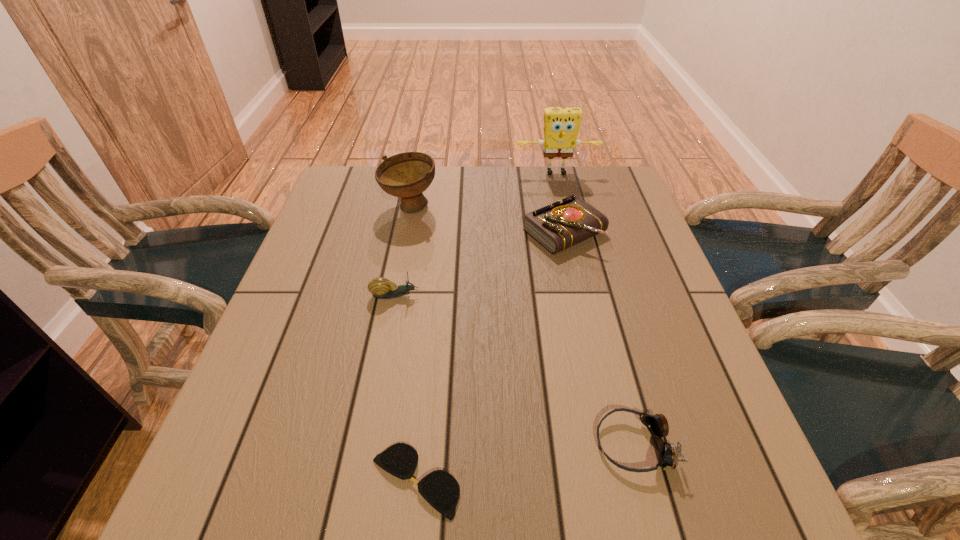
Where is `sponge at the right edge`? The image size is (960, 540). sponge at the right edge is located at coordinates (561, 125).

Where is `diary at the right edge`? The width and height of the screenshot is (960, 540). diary at the right edge is located at coordinates (569, 221).

Identify the location of goggles that is at the right edge. The width and height of the screenshot is (960, 540). (657, 424).

This screenshot has width=960, height=540. In order to click on sponge that is at the far right corner in this screenshot , I will do `click(561, 125)`.

Identify the location of diary that is at the far right corner. The width and height of the screenshot is (960, 540). (569, 221).

Find the location of a particular element. The image size is (960, 540). object located at the near right corner is located at coordinates (657, 424).

This screenshot has height=540, width=960. Find the location of `vacant space at the far edge of the desktop`. vacant space at the far edge of the desktop is located at coordinates (549, 191).

The image size is (960, 540). I want to click on free spot at the left edge of the desktop, so click(344, 231).

What are the coordinates of `vacant space at the right edge` in the screenshot? It's located at (659, 390).

Locate an element on the screen. This screenshot has width=960, height=540. vacant point at the far left corner is located at coordinates (338, 192).